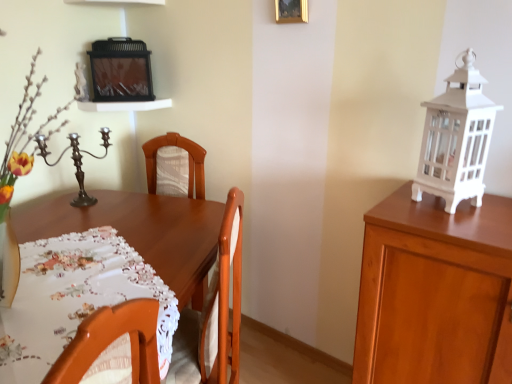
Question: Considering the relative positions of white wood cabinet at right and polished bronze candle holder at left in the image provided, is white wood cabinet at right to the right of polished bronze candle holder at left from the viewer's perspective?

Choices:
 (A) no
 (B) yes

Answer: (B)

Question: Can you confirm if white wood cabinet at right is taller than polished bronze candle holder at left?

Choices:
 (A) no
 (B) yes

Answer: (B)

Question: Is white wood cabinet at right wider than polished bronze candle holder at left?

Choices:
 (A) yes
 (B) no

Answer: (A)

Question: Is white wood cabinet at right next to polished bronze candle holder at left?

Choices:
 (A) yes
 (B) no

Answer: (B)

Question: Is white wood cabinet at right looking in the opposite direction of polished bronze candle holder at left?

Choices:
 (A) yes
 (B) no

Answer: (B)

Question: In the image, is gold metallic picture frame at upper center positioned in front of or behind white painted glass lantern at right?

Choices:
 (A) behind
 (B) front

Answer: (A)

Question: Is point (295, 9) positioned closer to the camera than point (437, 190)?

Choices:
 (A) farther
 (B) closer

Answer: (A)

Question: Considering the positions of gold metallic picture frame at upper center and white painted glass lantern at right in the image, is gold metallic picture frame at upper center bigger or smaller than white painted glass lantern at right?

Choices:
 (A) big
 (B) small

Answer: (B)

Question: In terms of height, does gold metallic picture frame at upper center look taller or shorter compared to white painted glass lantern at right?

Choices:
 (A) tall
 (B) short

Answer: (B)

Question: Considering their positions, is white printed tablecloth at center located in front of or behind polished bronze candle holder at left?

Choices:
 (A) front
 (B) behind

Answer: (A)

Question: From the image's perspective, relative to polished bronze candle holder at left, is white printed tablecloth at center above or below?

Choices:
 (A) above
 (B) below

Answer: (B)

Question: In the image, is white printed tablecloth at center on the left side or the right side of polished bronze candle holder at left?

Choices:
 (A) right
 (B) left

Answer: (A)

Question: From their relative heights in the image, would you say white printed tablecloth at center is taller or shorter than polished bronze candle holder at left?

Choices:
 (A) short
 (B) tall

Answer: (A)

Question: From a real-world perspective, is polished bronze candle holder at left positioned above or below white wood cabinet at right?

Choices:
 (A) below
 (B) above

Answer: (B)

Question: Considering the positions of polished bronze candle holder at left and white wood cabinet at right in the image, is polished bronze candle holder at left taller or shorter than white wood cabinet at right?

Choices:
 (A) short
 (B) tall

Answer: (A)